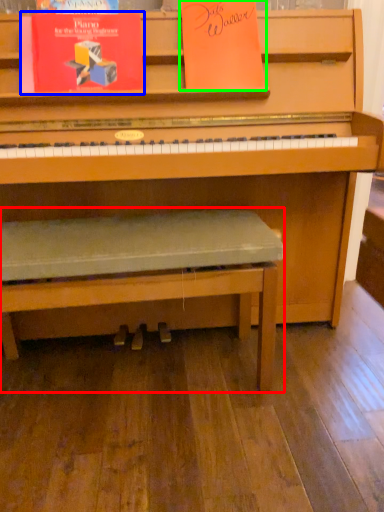
Question: Which object is the closest to the church bench (highlighted by a red box)? Choose among these: paperback book (highlighted by a blue box) or paperback book (highlighted by a green box).

Choices:
 (A) paperback book
 (B) paperback book

Answer: (A)